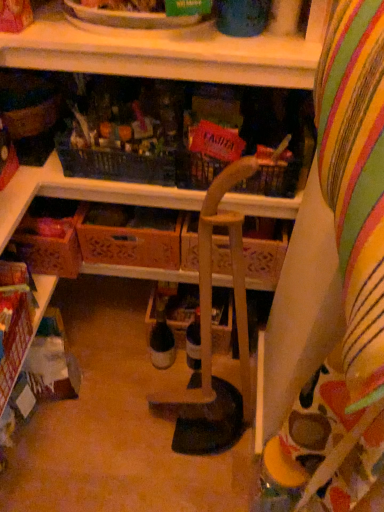
In order to click on vacant region below wooden crate at center, marked as the 2th drawer in a left-to-right arrangement (from a real-world perspective) in this screenshot , I will do `click(137, 304)`.